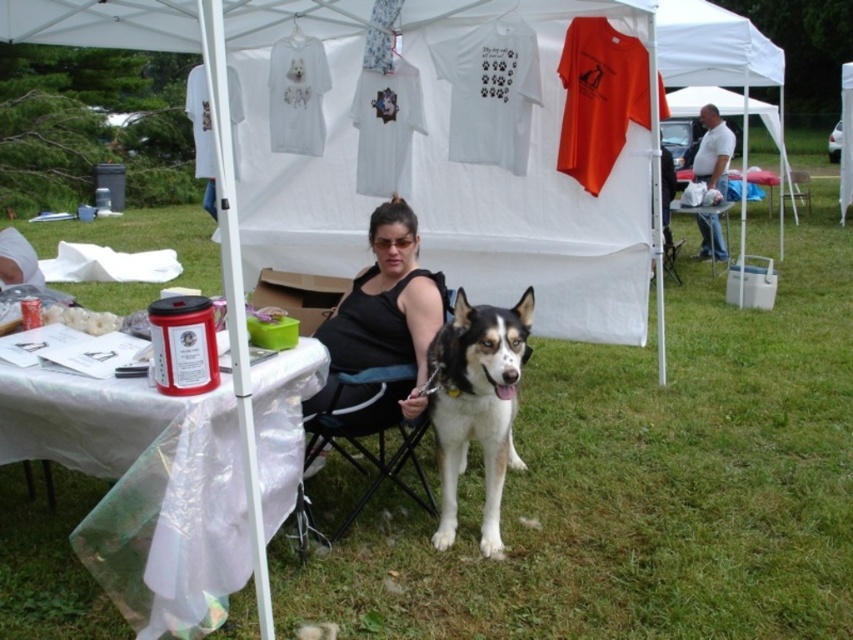
Question: Can you confirm if black fabric chair at center is positioned above metallic silver chair at center?

Choices:
 (A) no
 (B) yes

Answer: (A)

Question: Which point is closer to the camera?

Choices:
 (A) white plastic table at center
 (B) black fabric chair at center
 (C) metallic silver chair at center

Answer: (B)

Question: Which point is closer to the camera?

Choices:
 (A) black fabric chair at center
 (B) white fur dog at center
 (C) white plastic table at center
 (D) white plastic table at lower left

Answer: (D)

Question: Which point appears closest to the camera in this image?

Choices:
 (A) (491, 432)
 (B) (724, 200)

Answer: (A)

Question: Does white plastic table at lower left have a greater width compared to metallic silver chair at center?

Choices:
 (A) yes
 (B) no

Answer: (B)

Question: From the image, what is the correct spatial relationship of white plastic table at lower left in relation to white plastic table at center?

Choices:
 (A) above
 (B) below

Answer: (B)